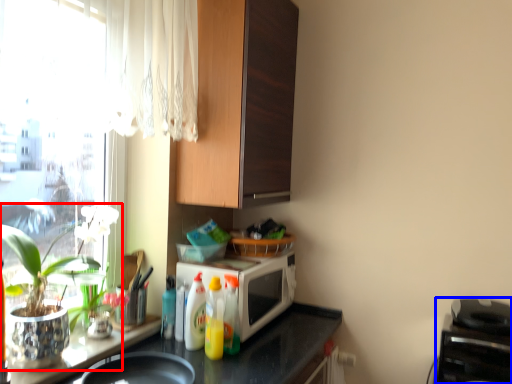
Question: Which of the following is the closest to the observer, houseplant (highlighted by a red box) or appliance (highlighted by a blue box)?

Choices:
 (A) houseplant
 (B) appliance

Answer: (A)